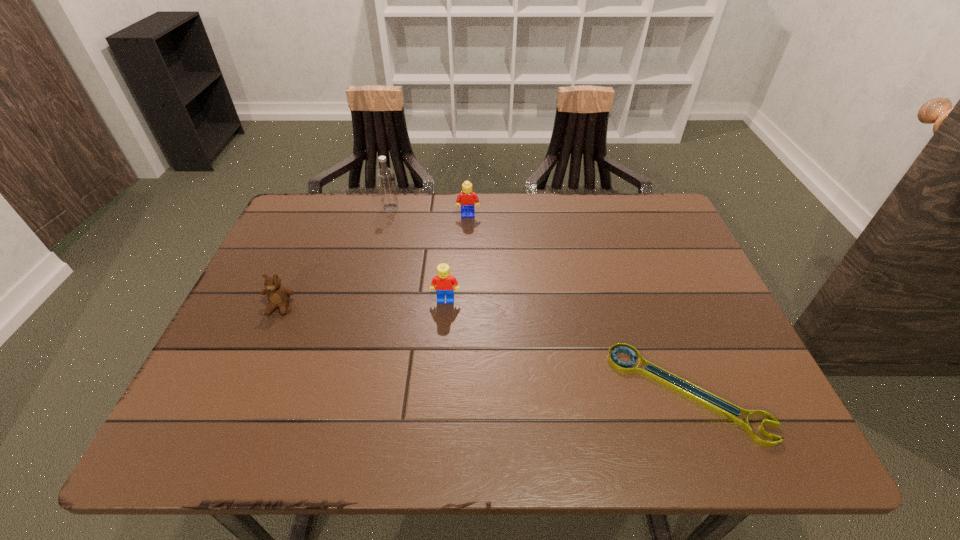
At what (x,y) coordinates should I click in order to perform the action: click on blank space at the near edge of the desktop. Please return your answer as a coordinate pair (x, y). The image size is (960, 540). Looking at the image, I should click on (426, 423).

At what (x,y) coordinates should I click in order to perform the action: click on vacant space at the left edge of the desktop. Please return your answer as a coordinate pair (x, y). This screenshot has height=540, width=960. Looking at the image, I should click on (241, 306).

Identify the location of vacant space at the right edge of the desktop. The width and height of the screenshot is (960, 540). (692, 379).

In the image, there is a desktop. Find the location of `vacant space at the far left corner`. vacant space at the far left corner is located at coordinates (325, 233).

The width and height of the screenshot is (960, 540). Find the location of `free space at the far right corner of the desktop`. free space at the far right corner of the desktop is located at coordinates (629, 211).

I want to click on blank region between the fourth nearest object and the nearest object, so click(578, 304).

Locate an element on the screen. The image size is (960, 540). empty space that is in between the fourth nearest object and the teddy bear is located at coordinates (374, 261).

The image size is (960, 540). I want to click on blank region between the teddy bear and the nearer Lego, so click(x=363, y=303).

This screenshot has height=540, width=960. Find the location of `empty location between the tallest object and the teddy bear`. empty location between the tallest object and the teddy bear is located at coordinates (335, 257).

At what (x,y) coordinates should I click in order to perform the action: click on free spot between the farther Lego and the rightmost object. Please return your answer as a coordinate pair (x, y). Looking at the image, I should click on (578, 304).